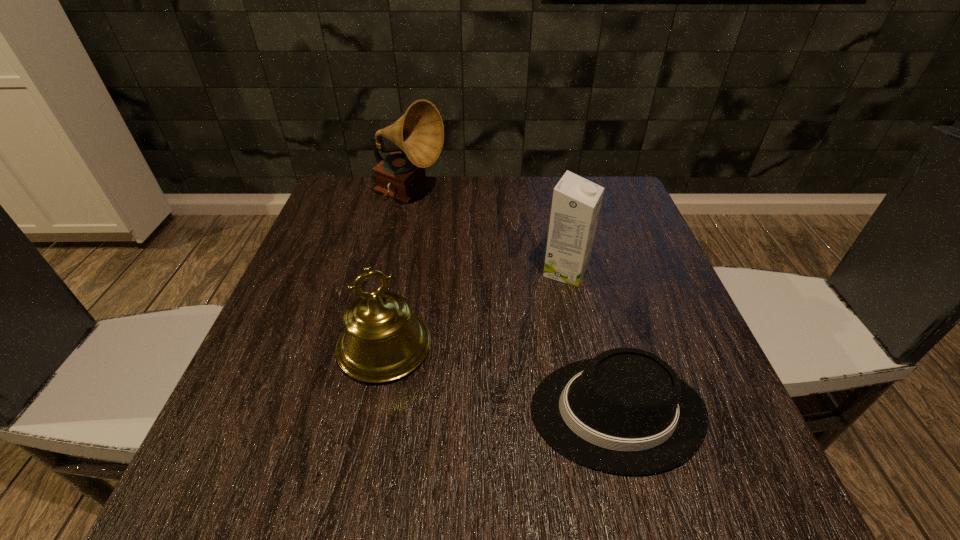
Find the location of a particular element. The height and width of the screenshot is (540, 960). free region at the right edge is located at coordinates (640, 251).

At what (x,y) coordinates should I click in order to perform the action: click on free space at the far left corner of the desktop. Please return your answer as a coordinate pair (x, y). Looking at the image, I should click on (320, 217).

Locate an element on the screen. The width and height of the screenshot is (960, 540). vacant space at the near left corner of the desktop is located at coordinates (297, 452).

At what (x,y) coordinates should I click in order to perform the action: click on vacant position at the near right corner of the desktop. Please return your answer as a coordinate pair (x, y). Looking at the image, I should click on (751, 504).

This screenshot has height=540, width=960. I want to click on vacant area that lies between the tallest object and the carton, so click(488, 233).

Where is `free point between the third nearest object and the fedora`? The image size is (960, 540). free point between the third nearest object and the fedora is located at coordinates (591, 342).

Where is `unoccupied position between the phonograph record and the bell`? unoccupied position between the phonograph record and the bell is located at coordinates (397, 271).

I want to click on free spot between the second farthest object and the bell, so click(x=475, y=309).

You are a GUI agent. You are given a task and a screenshot of the screen. Output one action in this format:
    pyautogui.click(x=<x>, y=<y>)
    Task: Click on the free space that is in between the carton and the farthest object
    
    Given the screenshot: What is the action you would take?
    pyautogui.click(x=488, y=233)

Locate an element on the screen. vacant area between the fedora and the third nearest object is located at coordinates (591, 342).